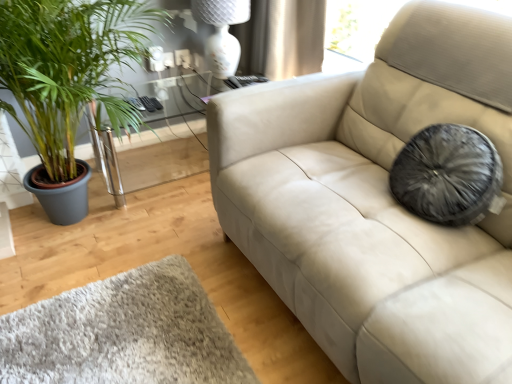
This screenshot has height=384, width=512. In order to click on free space in front of green leafy plant at left in this screenshot , I will do `click(137, 316)`.